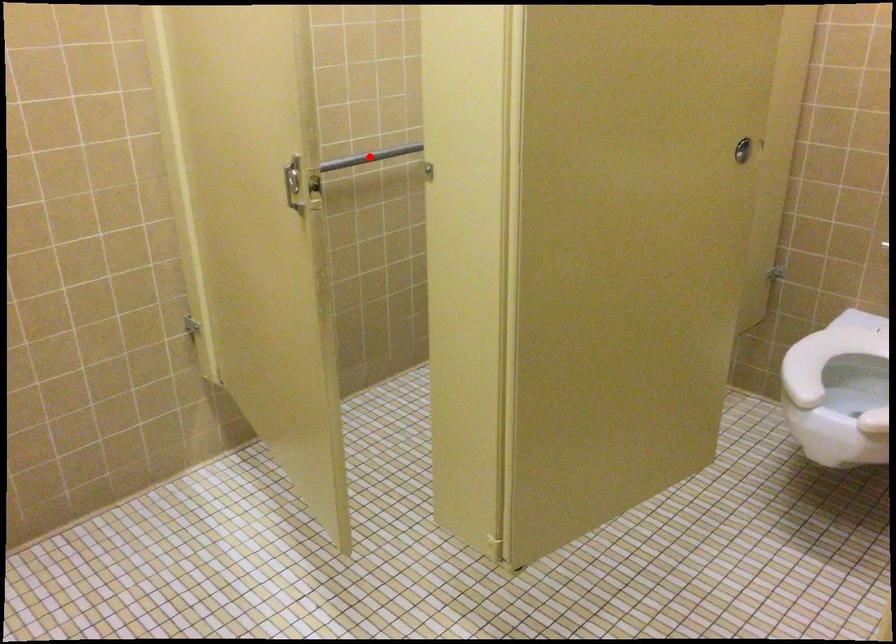
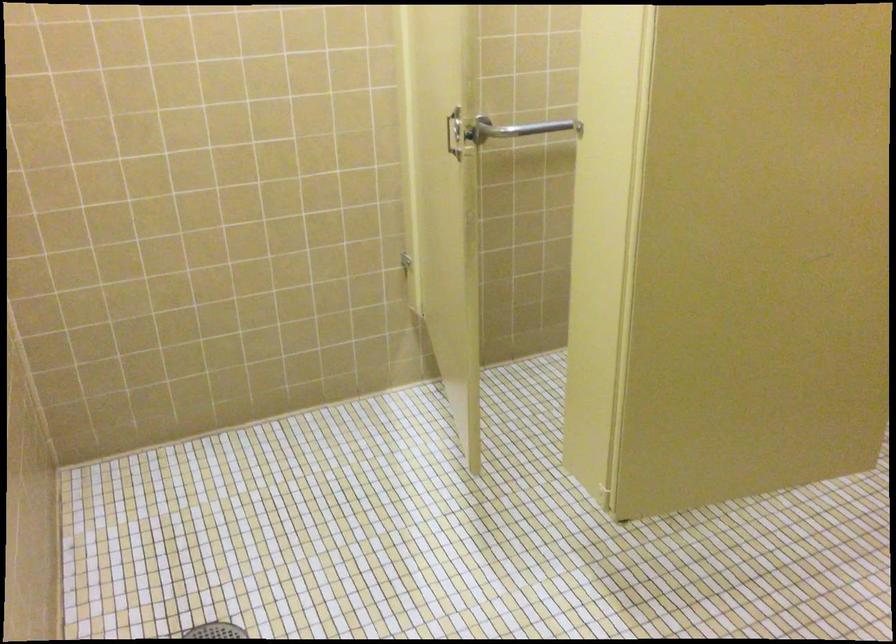
Question: I am providing you with two images of the same scene from different viewpoints. In image1, a red point is highlighted. Considering the same 3D point in image2, which of the following is correct?

Choices:
 (A) It is closer
 (B) It is farther

Answer: (A)